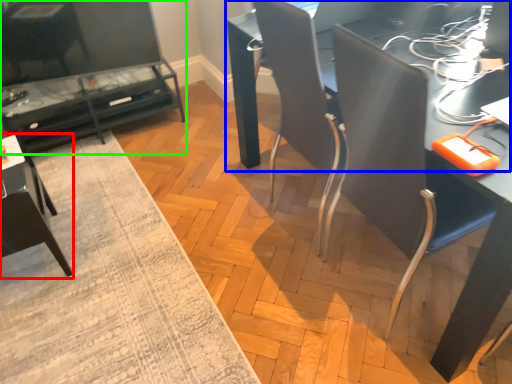
Question: Considering the real-world distances, which object is closest to armchair (highlighted by a red box)? table (highlighted by a blue box) or table (highlighted by a green box).

Choices:
 (A) table
 (B) table

Answer: (B)